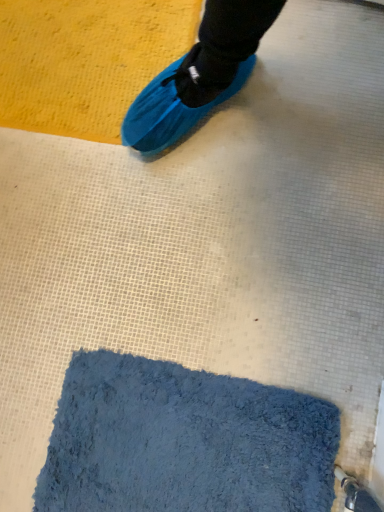
This screenshot has height=512, width=384. In order to click on vacant area on the back side of blue fuzzy bath mat at lower center in this screenshot , I will do `click(182, 253)`.